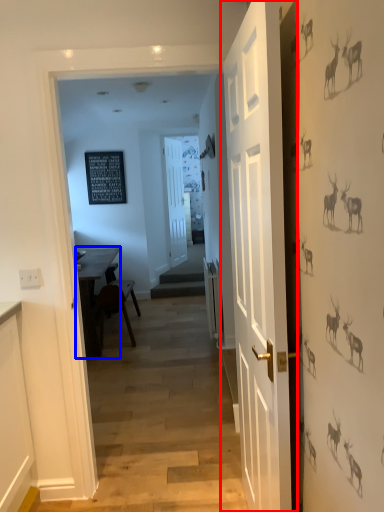
Question: Which point is further to the camera, door (highlighted by a red box) or table (highlighted by a blue box)?

Choices:
 (A) door
 (B) table

Answer: (B)